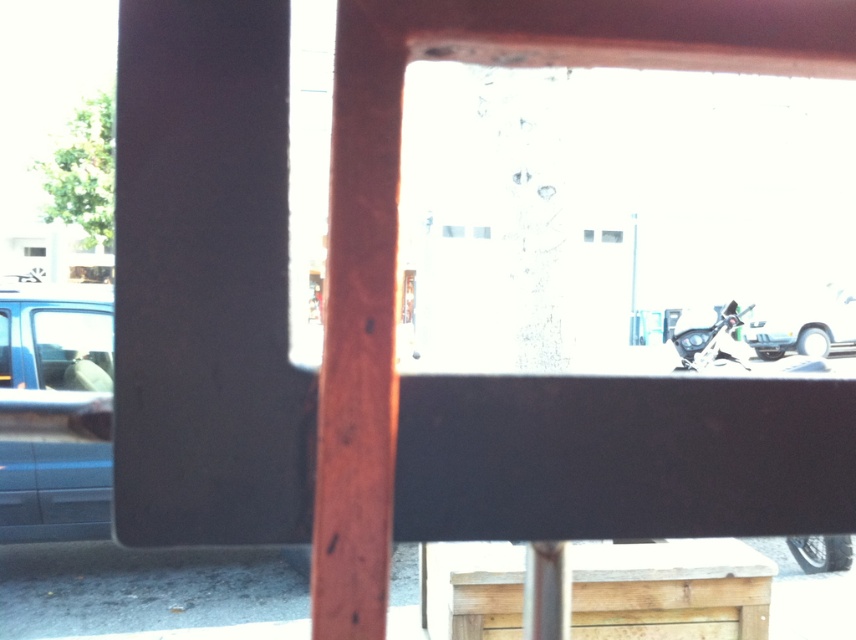
Does shiny silver car at right appear on the left side of shiny black motorcycle at lower right?

Incorrect, shiny silver car at right is not on the left side of shiny black motorcycle at lower right.

Does shiny silver car at right appear under shiny black motorcycle at lower right?

No, shiny silver car at right is not below shiny black motorcycle at lower right.

Describe the element at coordinates (803, 321) in the screenshot. I see `shiny silver car at right` at that location.

The image size is (856, 640). I want to click on shiny silver car at right, so click(x=803, y=321).

Is point (693, 340) more distant than point (728, 305)?

Yes, point (693, 340) is behind point (728, 305).

Which is in front, point (730, 355) or point (733, 305)?

Point (733, 305) is more forward.

The image size is (856, 640). Describe the element at coordinates (712, 344) in the screenshot. I see `shiny black motorcycle at lower right` at that location.

Identify the location of shiny black motorcycle at lower right. (712, 344).

Is point (849, 294) closer to camera compared to point (712, 337)?

No.

Can you confirm if shiny silver car at right is bigger than shiny metallic motorcycle at lower right?

Correct, shiny silver car at right is larger in size than shiny metallic motorcycle at lower right.

Between point (830, 301) and point (724, 307), which one is positioned in front?

Positioned in front is point (724, 307).

Where is `shiny silver car at right`? The width and height of the screenshot is (856, 640). shiny silver car at right is located at coordinates (803, 321).